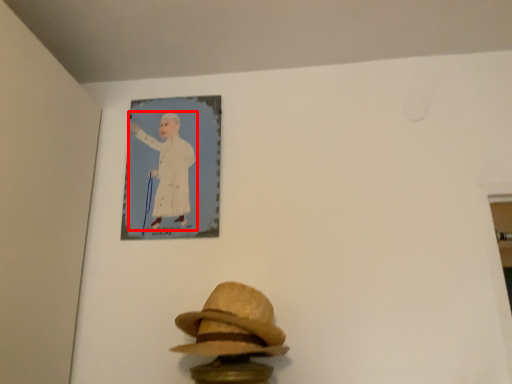
Question: Where is person (annotated by the red box) located in relation to fedora in the image?

Choices:
 (A) right
 (B) left

Answer: (B)